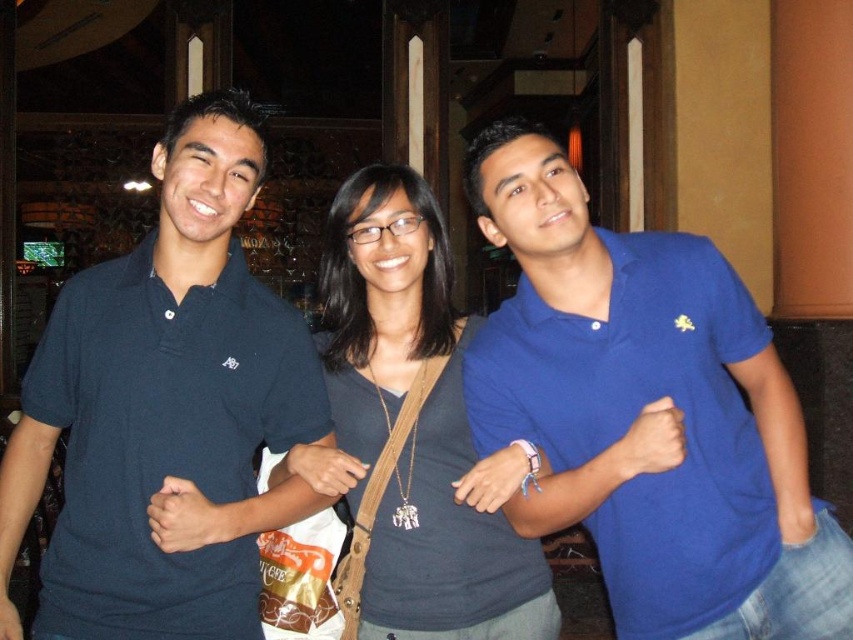
Question: Which point is farther from the camera taking this photo?

Choices:
 (A) (563, 508)
 (B) (73, 417)
 (C) (480, 515)

Answer: (C)

Question: Which object is positioned farthest from the dark blue polo shirt at left?

Choices:
 (A) blue cotton polo shirt at center
 (B) matte gray shirt at center

Answer: (A)

Question: Observing the image, what is the correct spatial positioning of blue cotton polo shirt at center in reference to dark blue polo shirt at left?

Choices:
 (A) left
 (B) right

Answer: (B)

Question: Which of the following is the closest to the observer?

Choices:
 (A) dark blue polo shirt at left
 (B) blue cotton polo shirt at center

Answer: (A)

Question: Can you confirm if blue cotton polo shirt at center is wider than matte gray shirt at center?

Choices:
 (A) yes
 (B) no

Answer: (A)

Question: Can you confirm if blue cotton polo shirt at center is smaller than matte gray shirt at center?

Choices:
 (A) no
 (B) yes

Answer: (B)